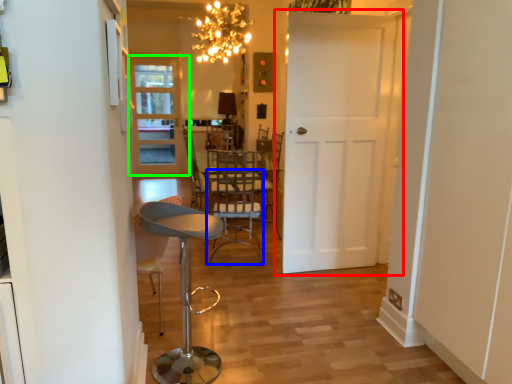
Question: Which is farther away from door (highlighted by a red box)? armchair (highlighted by a blue box) or door (highlighted by a green box)?

Choices:
 (A) armchair
 (B) door

Answer: (B)